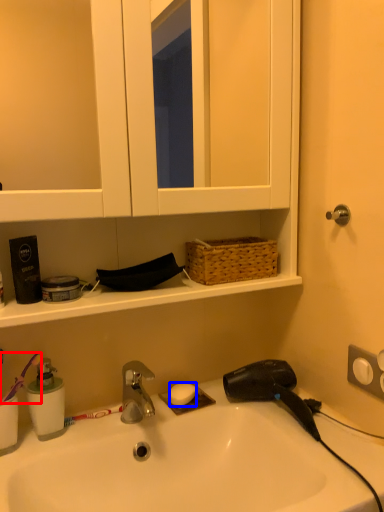
Question: Which point is further to the camera, brush (highlighted by a red box) or soap (highlighted by a blue box)?

Choices:
 (A) brush
 (B) soap

Answer: (B)